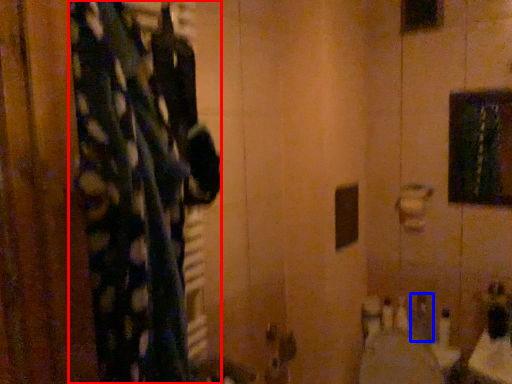
Question: Which object is further to the camera taking this photo, curtain (highlighted by a red box) or toiletry (highlighted by a blue box)?

Choices:
 (A) curtain
 (B) toiletry

Answer: (B)